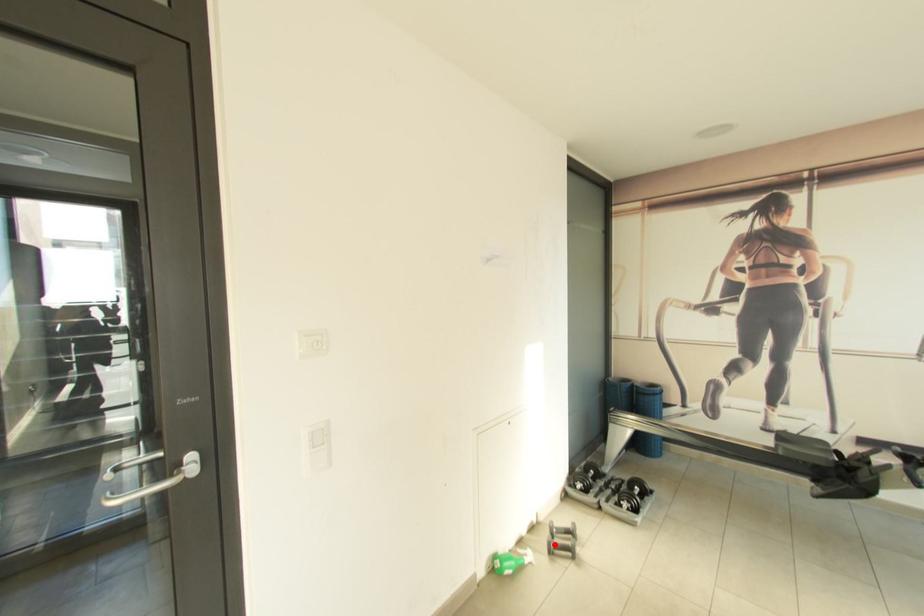
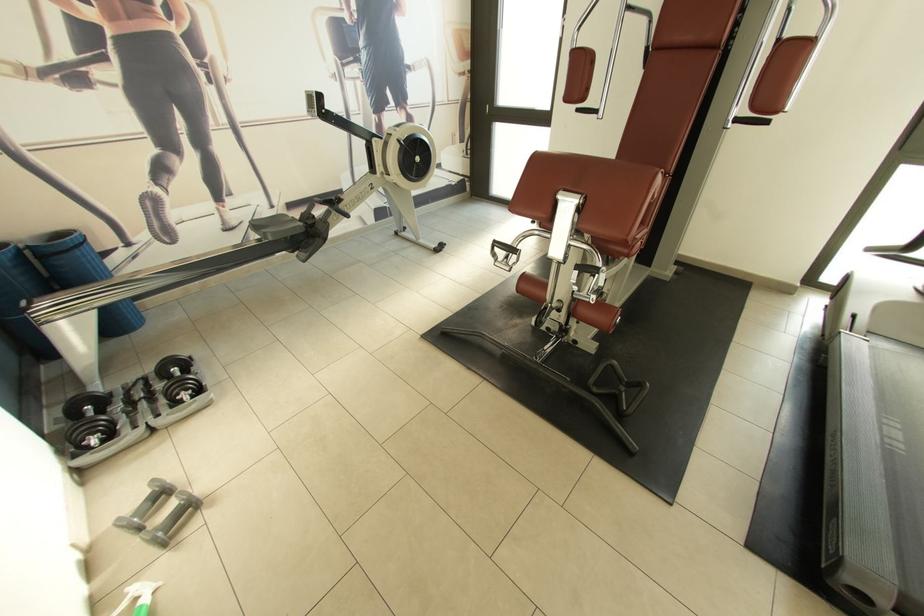
Question: I am providing you with two images of the same scene from different viewpoints. Image1 has a red point marked. In image2, the corresponding 3D location appears at what relative position? Reply with the corresponding letter.

Choices:
 (A) Closer
 (B) Farther

Answer: (A)